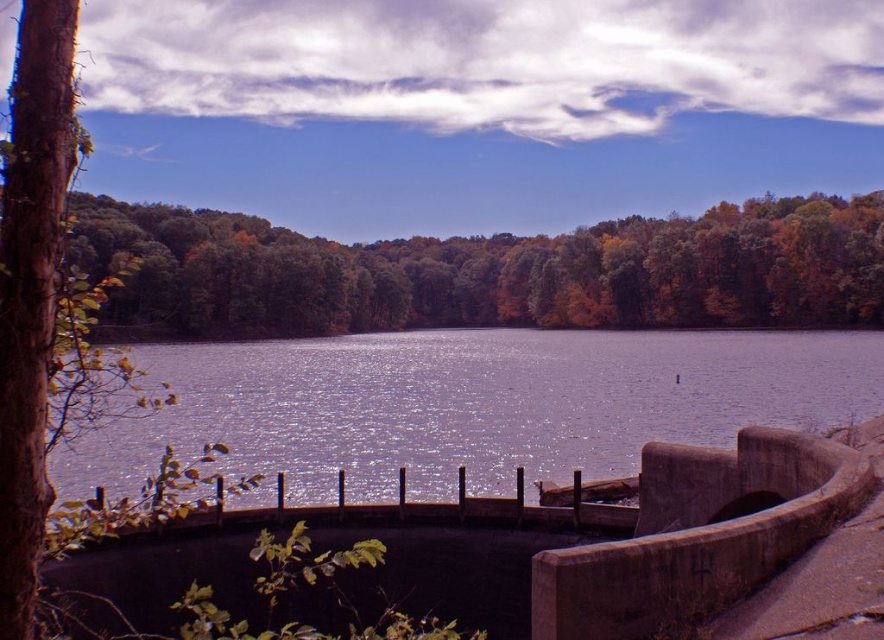
You are standing at the lakeside and want to take a photo of the concrete dam at lower center and the green leafy trees at center. Which object will appear smaller in your photo?

The concrete dam at lower center will appear smaller in the photo because it is shorter than the green leafy trees at center.

You are standing at the lakeside and want to cross to the other side. You see the concrete dam at lower center and the glistening water at center. Which object should you step onto to avoid getting wet?

You should step onto the concrete dam at lower center because it is to the left of the glistening water at center, meaning it is a solid structure and not part of the water.

Based on the photo, you are standing at the lakeside and want to take a photo of the glistening water at center and the green leafy trees at center. Which object should you focus on first to ensure it appears sharp in the photo?

You should focus on the glistening water at center first because it is closer to you than the green leafy trees at center, so focusing on it will keep it sharp while the trees may appear slightly blurred. Alternatively, focus somewhere in between for both to be sharp.